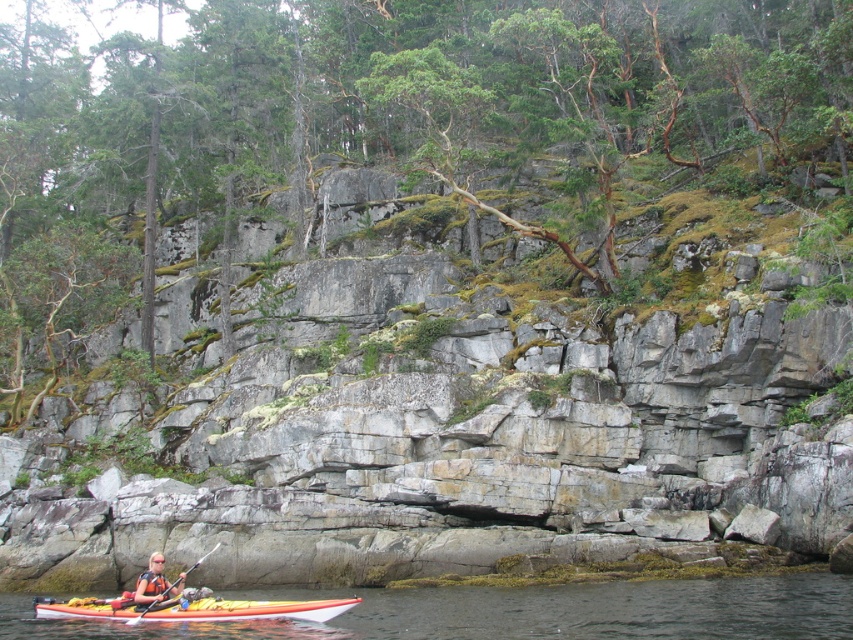
You are a photographer planning to capture the kayaker and the surrounding environment. Given that the green mossy rock at center and the clear water at lower center are in the frame, which object occupies a larger portion of the image?

The green mossy rock at center occupies a larger portion of the image than the clear water at lower center because it is bigger according to the description.

You are a kayaker preparing to navigate through the water near the gray rock cliff at center and the clear water at lower center. Which object would you need to avoid due to its size?

The gray rock cliff at center is larger in size than the clear water at lower center, so you should avoid the gray rock cliff at center as it poses a greater collision risk.